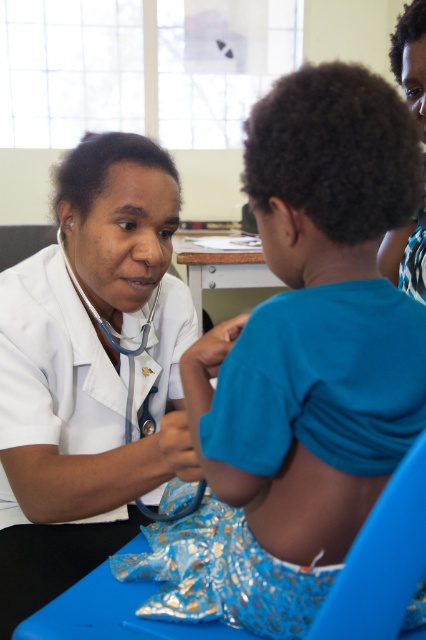
Question: Can you confirm if white smooth stethoscope at center is smaller than blue rubber stethoscope at left?

Choices:
 (A) yes
 (B) no

Answer: (B)

Question: Which point appears farthest from the camera in this image?

Choices:
 (A) (115, 330)
 (B) (397, 257)

Answer: (B)

Question: Which of these objects is positioned closest to the blue rubber stethoscope at left?

Choices:
 (A) matte white coat at upper left
 (B) white smooth stethoscope at center

Answer: (B)

Question: Does white smooth stethoscope at center come in front of matte white coat at upper left?

Choices:
 (A) no
 (B) yes

Answer: (B)

Question: Estimate the real-world distances between objects in this image. Which object is farther from the blue rubber stethoscope at left?

Choices:
 (A) white smooth stethoscope at center
 (B) matte white coat at upper left

Answer: (B)

Question: Can you confirm if matte white coat at upper left is positioned to the left of blue rubber stethoscope at left?

Choices:
 (A) yes
 (B) no

Answer: (B)